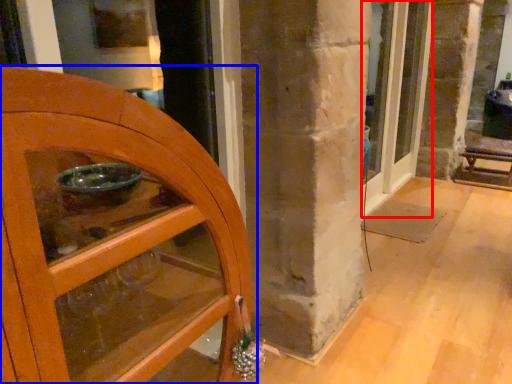
Question: Which point is closer to the camera, door (highlighted by a red box) or door (highlighted by a blue box)?

Choices:
 (A) door
 (B) door

Answer: (B)